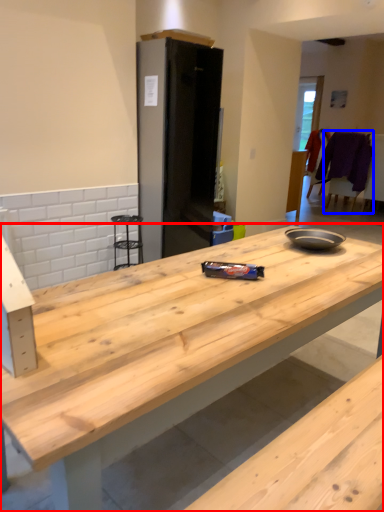
Question: Which of the following is the closest to the observer, countertop (highlighted by a red box) or chair (highlighted by a blue box)?

Choices:
 (A) countertop
 (B) chair

Answer: (A)